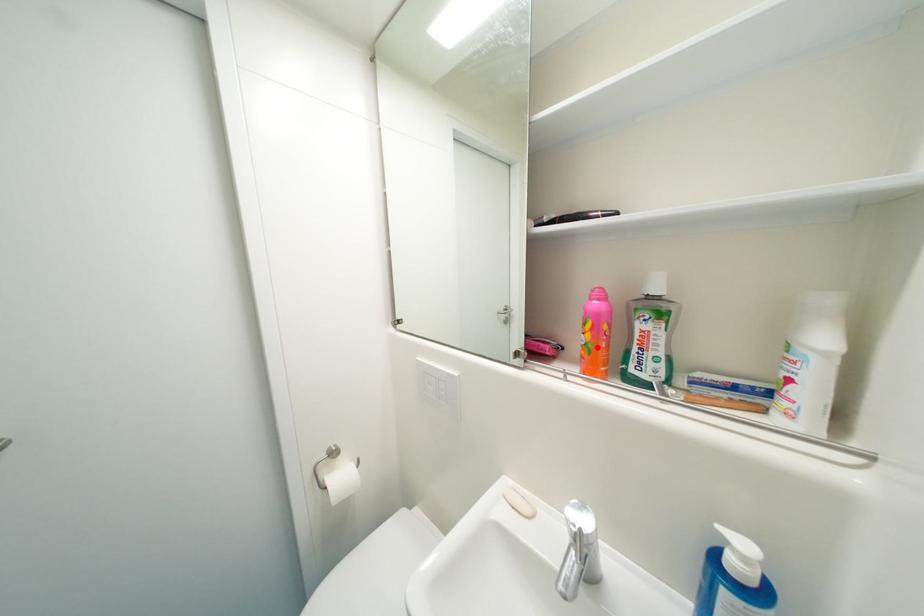
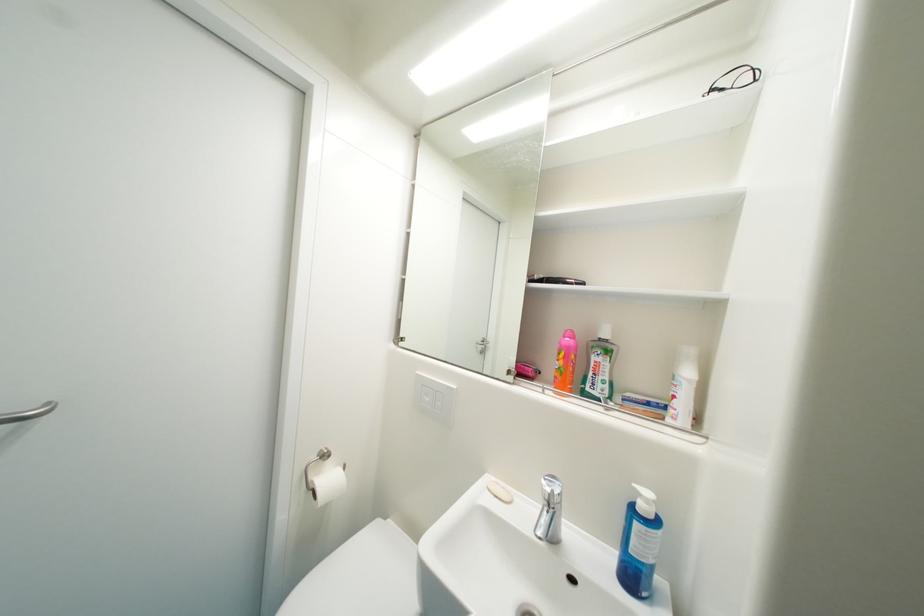
Find the pixel in the second image that matches the highlighted location in the first image.

(569, 371)